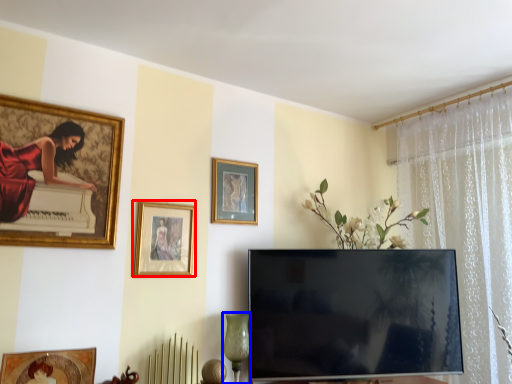
Question: Which of the following is the farthest to the observer, picture frame (highlighted by a red box) or glass vase (highlighted by a blue box)?

Choices:
 (A) picture frame
 (B) glass vase

Answer: (A)